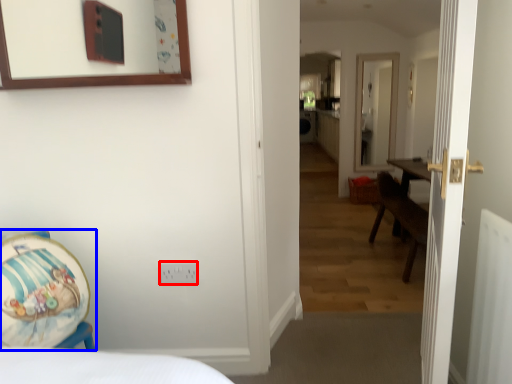
Question: Among these objects, which one is nearest to the camera, electric outlet (highlighted by a red box) or armchair (highlighted by a blue box)?

Choices:
 (A) electric outlet
 (B) armchair

Answer: (B)